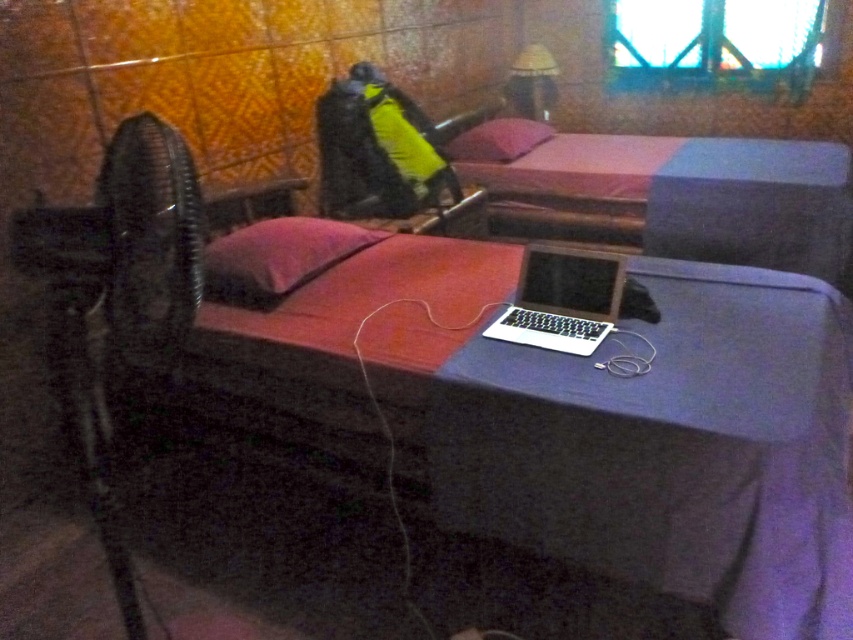
Between point (180, 227) and point (531, 296), which one is positioned in front?

Point (180, 227)

Does black plastic fan at left have a lesser width compared to silver metallic laptop at center?

Yes.

Is point (125, 339) more distant than point (612, 326)?

No.

Image resolution: width=853 pixels, height=640 pixels. I want to click on black plastic fan at left, so click(151, 241).

How much distance is there between black plastic fan at left and matte yellow lampshade at upper center?

They are 11.94 feet apart.

Is black plastic fan at left to the left of matte yellow lampshade at upper center from the viewer's perspective?

Yes, black plastic fan at left is to the left of matte yellow lampshade at upper center.

Is point (175, 164) farther from viewer compared to point (532, 104)?

That is False.

At what (x,y) coordinates should I click in order to perform the action: click on black plastic fan at left. Please return your answer as a coordinate pair (x, y). Image resolution: width=853 pixels, height=640 pixels. Looking at the image, I should click on (151, 241).

In the scene shown: Does pink fabric pillow at center have a greater width compared to velvet-like pink pillow at center?

No, pink fabric pillow at center is not wider than velvet-like pink pillow at center.

Who is higher up, pink fabric pillow at center or velvet-like pink pillow at center?

velvet-like pink pillow at center

Which is behind, point (343, 259) or point (463, 157)?

The point (463, 157) is more distant.

Locate an element on the screen. The height and width of the screenshot is (640, 853). pink fabric pillow at center is located at coordinates (277, 257).